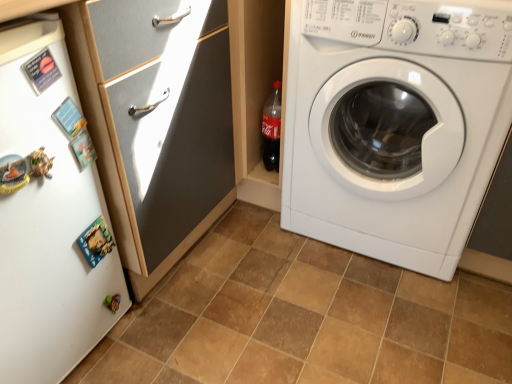
Question: Is point (129, 152) positioned closer to the camera than point (480, 49)?

Choices:
 (A) farther
 (B) closer

Answer: (A)

Question: Is white glossy cabinet at upper left taller or shorter than white glossy washing machine at right?

Choices:
 (A) short
 (B) tall

Answer: (B)

Question: Which object is positioned closest to the white matte refrigerator at left?

Choices:
 (A) white glossy cabinet at upper left
 (B) brown matte tile at center
 (C) white glossy washing machine at right

Answer: (A)

Question: Based on their relative distances, which object is nearer to the white glossy washing machine at right?

Choices:
 (A) white glossy cabinet at upper left
 (B) white matte refrigerator at left
 (C) brown matte tile at center

Answer: (C)